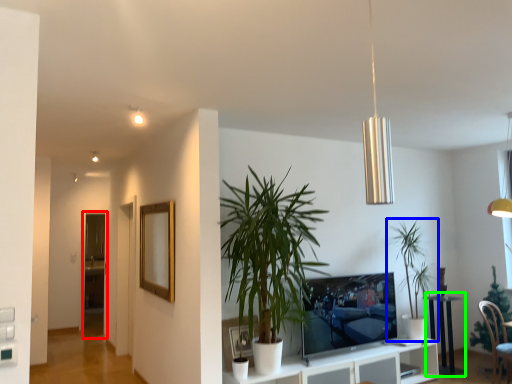
Question: Considering the real-world distances, which object is closest to glass door (highlighted by a red box)? houseplant (highlighted by a blue box) or table (highlighted by a green box).

Choices:
 (A) houseplant
 (B) table

Answer: (A)